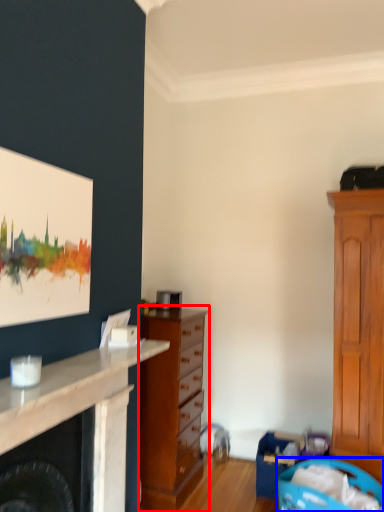
Question: Which object is closer to the camera taking this photo, chest of drawers (highlighted by a red box) or laundry basket (highlighted by a blue box)?

Choices:
 (A) chest of drawers
 (B) laundry basket

Answer: (B)